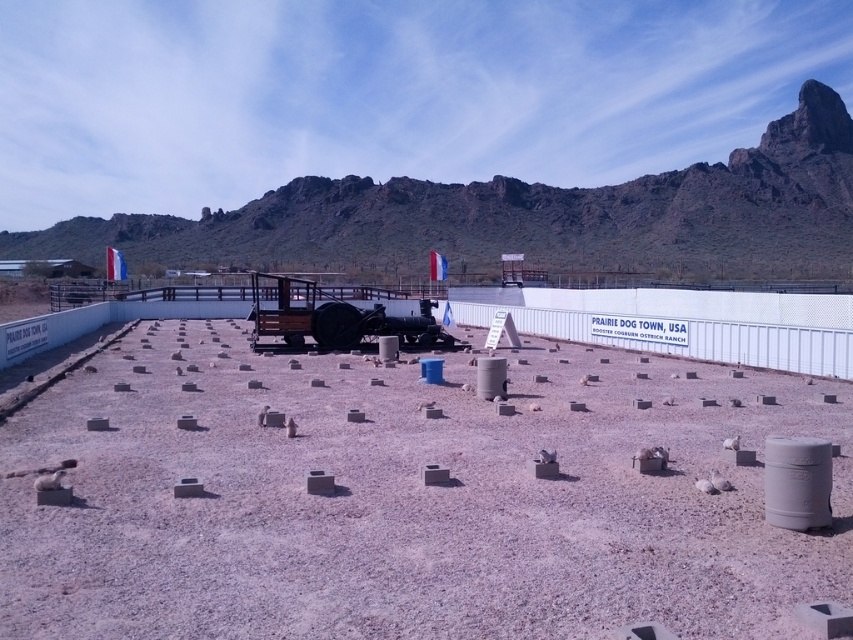
Question: In this image, where is brown gravel dirt at center located relative to rustic wood wagon at center?

Choices:
 (A) below
 (B) above

Answer: (A)

Question: Which is farther from the rugged rock formation at upper center?

Choices:
 (A) brown gravel dirt at center
 (B) rustic wood wagon at center

Answer: (A)

Question: Which object is closer to the camera taking this photo?

Choices:
 (A) rustic wood wagon at center
 (B) brown gravel dirt at center

Answer: (B)

Question: Which object is positioned closest to the rustic wood wagon at center?

Choices:
 (A) rugged rock formation at upper center
 (B) brown gravel dirt at center

Answer: (B)

Question: In this image, where is rugged rock formation at upper center located relative to rustic wood wagon at center?

Choices:
 (A) right
 (B) left

Answer: (B)

Question: Is brown gravel dirt at center positioned before rugged rock formation at upper center?

Choices:
 (A) no
 (B) yes

Answer: (B)